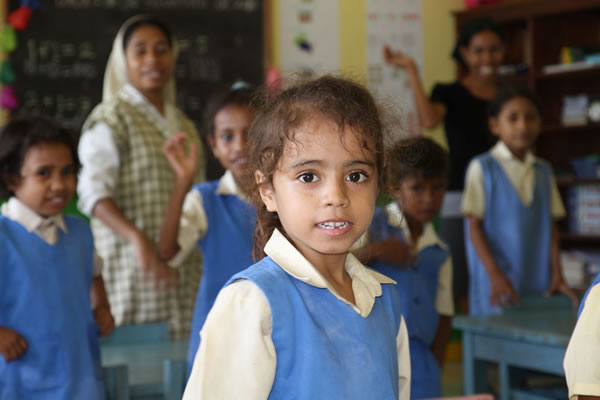
Locate an element on the screen. Image resolution: width=600 pixels, height=400 pixels. posters on wall is located at coordinates (317, 26), (393, 27).